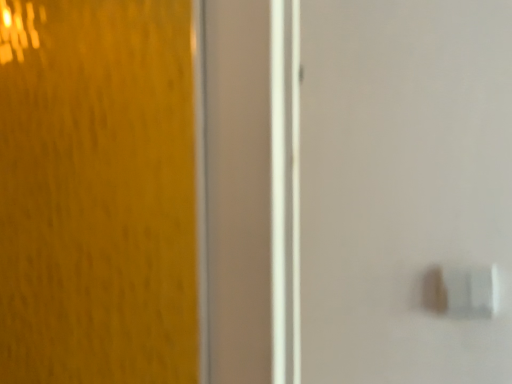
Measure the distance between point (483, 312) and camera.

26.38 inches.

This screenshot has width=512, height=384. What do you see at coordinates (462, 291) in the screenshot?
I see `white plastic light switch at lower right` at bounding box center [462, 291].

The image size is (512, 384). In order to click on white plastic light switch at lower right in this screenshot , I will do `click(462, 291)`.

You are a GUI agent. You are given a task and a screenshot of the screen. Output one action in this format:
    pyautogui.click(x=<x>, y=<y>)
    Task: Click on the white plastic light switch at lower right
    This screenshot has width=512, height=384.
    Given the screenshot: What is the action you would take?
    pyautogui.click(x=462, y=291)